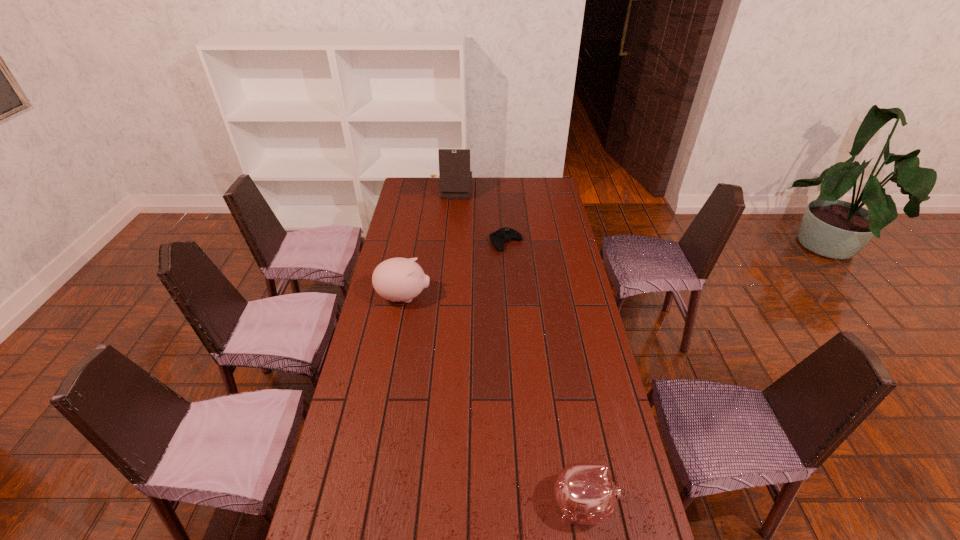
Identify the location of free space between the shorter piggy bank and the taller piggy bank. (493, 401).

You are a GUI agent. You are given a task and a screenshot of the screen. Output one action in this format:
    pyautogui.click(x=<x>, y=<y>)
    Task: Click on the free spot between the left piggy bank and the second farthest object
    The width and height of the screenshot is (960, 540).
    Given the screenshot: What is the action you would take?
    pyautogui.click(x=455, y=270)

Find the location of a particular element. Image resolution: width=960 pixels, height=540 pixels. free space between the third shortest object and the farthest object is located at coordinates (427, 244).

This screenshot has width=960, height=540. I want to click on unoccupied position between the tallest object and the taller piggy bank, so click(427, 244).

Image resolution: width=960 pixels, height=540 pixels. What are the coordinates of `blank region between the shorter piggy bank and the tallest object` in the screenshot? It's located at (516, 347).

Identify the location of free spot between the third farthest object and the shortest object. This screenshot has width=960, height=540. (455, 270).

Where is `vacant space in between the third tallest object and the third farthest object`? vacant space in between the third tallest object and the third farthest object is located at coordinates (493, 401).

Locate an element on the screen. This screenshot has height=540, width=960. vacant region between the second farthest object and the right piggy bank is located at coordinates (544, 374).

I want to click on object that is the closest to the second shortest object, so click(398, 279).

Where is `object that ranks as the third closest to the right piggy bank`? object that ranks as the third closest to the right piggy bank is located at coordinates (455, 176).